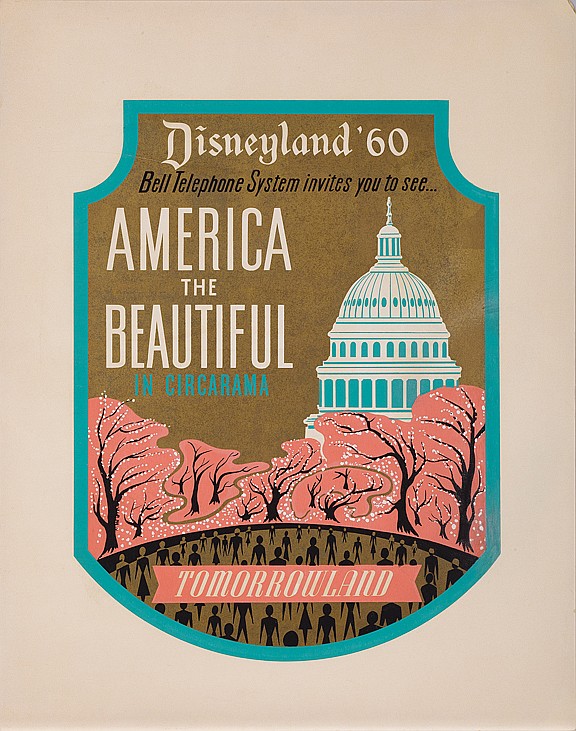
This screenshot has width=576, height=731. Identify the location of poster. (312, 0).